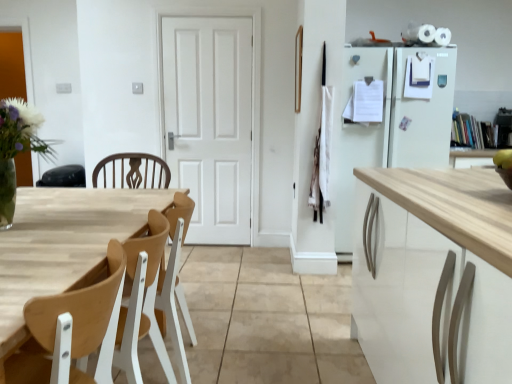
Find the location of a particular element. free space on the front side of white matte door at center is located at coordinates (202, 257).